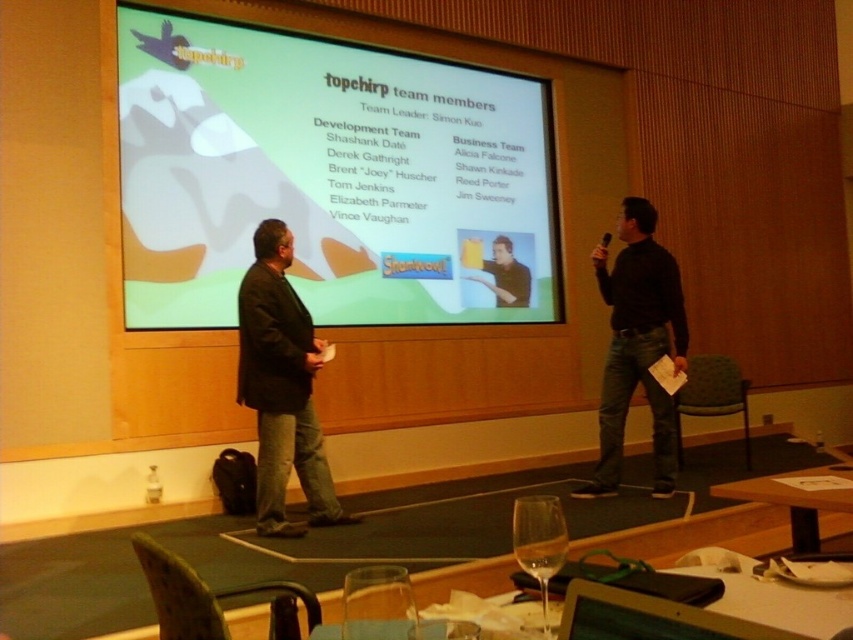
Question: Considering the real-world distances, which object is farthest from the transparent glass at lower center?

Choices:
 (A) black matte sweater at center
 (B) matte black shirt at center

Answer: (B)

Question: Which point is closer to the camera taking this photo?

Choices:
 (A) (479, 298)
 (B) (291, 340)
 (C) (386, 593)

Answer: (C)

Question: Is transparent glass at lower center smaller than clear glass wine glass at lower center?

Choices:
 (A) no
 (B) yes

Answer: (A)

Question: Is the position of wooden table at lower right more distant than that of clear glass wine glass at lower center?

Choices:
 (A) no
 (B) yes

Answer: (B)

Question: Which object is closer to the camera taking this photo?

Choices:
 (A) matte black shirt at center
 (B) transparent glass at lower center
 (C) wooden table at lower right

Answer: (C)

Question: Is dark brown leather jacket at center positioned at the back of transparent glass at lower center?

Choices:
 (A) yes
 (B) no

Answer: (A)